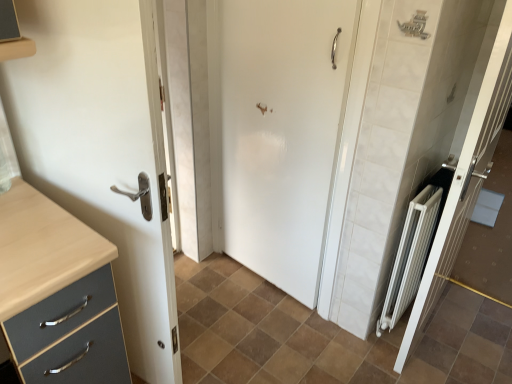
Question: Is white metallic radiator at right, marked as the 1th door in a right-to-left arrangement, located outside white glossy door at left, which appears as the third door when viewed from the right?

Choices:
 (A) yes
 (B) no

Answer: (A)

Question: Considering the relative sizes of white metallic radiator at right, marked as the 1th door in a right-to-left arrangement, and white glossy door at left, marked as the 1th door in a left-to-right arrangement, in the image provided, is white metallic radiator at right, marked as the 1th door in a right-to-left arrangement, taller than white glossy door at left, marked as the 1th door in a left-to-right arrangement,?

Choices:
 (A) yes
 (B) no

Answer: (A)

Question: From a real-world perspective, is white metallic radiator at right, marked as the third door in a left-to-right arrangement, under white glossy door at left, which appears as the third door when viewed from the right?

Choices:
 (A) yes
 (B) no

Answer: (B)

Question: Considering the relative sizes of white metallic radiator at right, marked as the third door in a left-to-right arrangement, and white glossy door at left, marked as the 1th door in a left-to-right arrangement, in the image provided, is white metallic radiator at right, marked as the third door in a left-to-right arrangement, bigger than white glossy door at left, marked as the 1th door in a left-to-right arrangement,?

Choices:
 (A) yes
 (B) no

Answer: (B)

Question: Is white metallic radiator at right, marked as the third door in a left-to-right arrangement, shorter than white glossy door at left, which appears as the third door when viewed from the right?

Choices:
 (A) no
 (B) yes

Answer: (A)

Question: Based on their sizes in the image, would you say white matte door at center, arranged as the 2th door when viewed from the left, is bigger or smaller than white metallic radiator at right, marked as the 1th door in a right-to-left arrangement?

Choices:
 (A) small
 (B) big

Answer: (A)

Question: Does point coord(309,150) appear closer or farther from the camera than point coord(470,188)?

Choices:
 (A) closer
 (B) farther

Answer: (A)

Question: Choose the correct answer: Is white matte door at center, arranged as the 2th door when viewed from the left, inside white metallic radiator at right, marked as the 1th door in a right-to-left arrangement, or outside it?

Choices:
 (A) inside
 (B) outside

Answer: (B)

Question: In the image, is white matte door at center, arranged as the second door when viewed from the right, positioned in front of or behind white metallic radiator at right, marked as the 1th door in a right-to-left arrangement?

Choices:
 (A) front
 (B) behind

Answer: (B)

Question: Is white matte door at center, arranged as the 2th door when viewed from the left, taller or shorter than white glossy door at left, marked as the 1th door in a left-to-right arrangement?

Choices:
 (A) short
 (B) tall

Answer: (A)

Question: Which is correct: white matte door at center, arranged as the second door when viewed from the right, is inside white glossy door at left, marked as the 1th door in a left-to-right arrangement, or outside of it?

Choices:
 (A) inside
 (B) outside

Answer: (B)

Question: From a real-world perspective, is white matte door at center, arranged as the second door when viewed from the right, above or below white glossy door at left, which appears as the third door when viewed from the right?

Choices:
 (A) above
 (B) below

Answer: (B)

Question: Is point (318, 94) closer or farther from the camera than point (91, 97)?

Choices:
 (A) closer
 (B) farther

Answer: (B)

Question: In the image, is brown matte tile at center positioned in front of or behind white metallic radiator at right, marked as the 1th door in a right-to-left arrangement?

Choices:
 (A) front
 (B) behind

Answer: (B)

Question: In terms of height, does brown matte tile at center look taller or shorter compared to white metallic radiator at right, marked as the 1th door in a right-to-left arrangement?

Choices:
 (A) short
 (B) tall

Answer: (A)